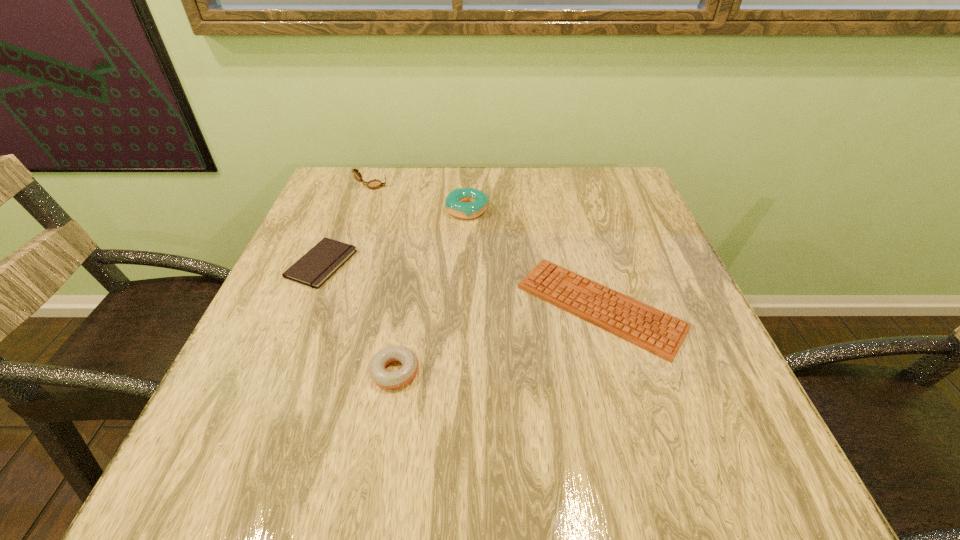
The width and height of the screenshot is (960, 540). I want to click on unoccupied position between the checkbook and the left doughnut, so click(x=358, y=318).

Find the location of a particular element. This screenshot has height=540, width=960. vacant space that's between the checkbook and the computer keyboard is located at coordinates (461, 285).

Find the location of a particular element. This screenshot has width=960, height=540. empty space that is in between the rightmost object and the third object from right to left is located at coordinates (497, 339).

The width and height of the screenshot is (960, 540). I want to click on empty space between the computer keyboard and the left doughnut, so point(497,339).

Locate an element on the screen. unoccupied area between the third object from right to left and the tallest object is located at coordinates (383, 279).

Find the location of a particular element. free space that is in between the tallest object and the checkbook is located at coordinates (347, 225).

Identify which object is located as the nearest to the rightmost object. Please provide its 2D coordinates. Your answer should be formatted as a tuple, i.e. [(x, y)], where the tuple contains the x and y coordinates of a point satisfying the conditions above.

[(466, 203)]

Identify which object is the closest to the rightmost object. Please provide its 2D coordinates. Your answer should be formatted as a tuple, i.e. [(x, y)], where the tuple contains the x and y coordinates of a point satisfying the conditions above.

[(466, 203)]

Identify the location of free space that satisfies the following two spatial constraints: 1. on the face of the computer keyboard; 2. on the left side of the compass. (329, 307).

You are a GUI agent. You are given a task and a screenshot of the screen. Output one action in this format:
    pyautogui.click(x=<x>, y=<y>)
    Task: Click on the free space that satisfies the following two spatial constraints: 1. on the back side of the shorter doughnut; 2. on the face of the tallest object
    The image size is (960, 540).
    Given the screenshot: What is the action you would take?
    pyautogui.click(x=427, y=186)